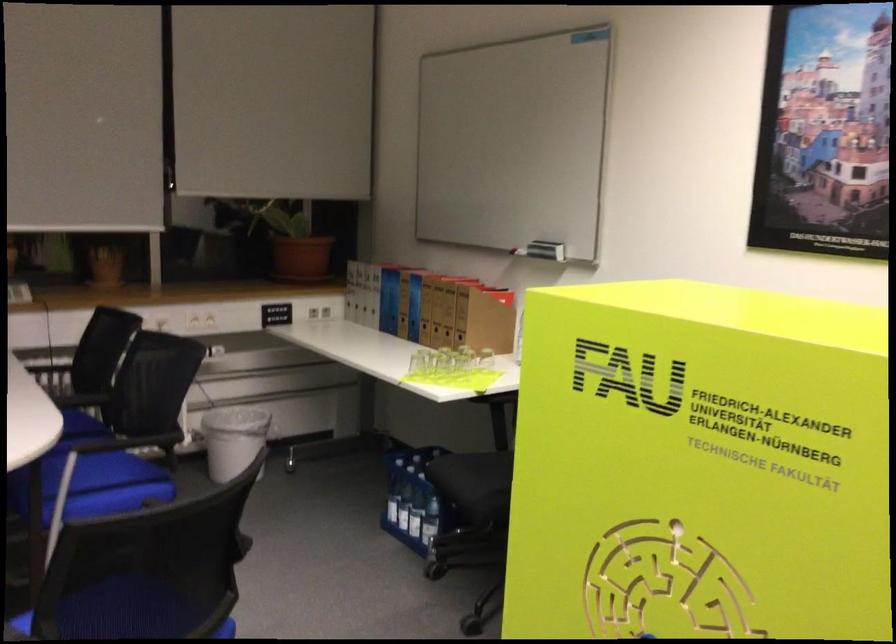
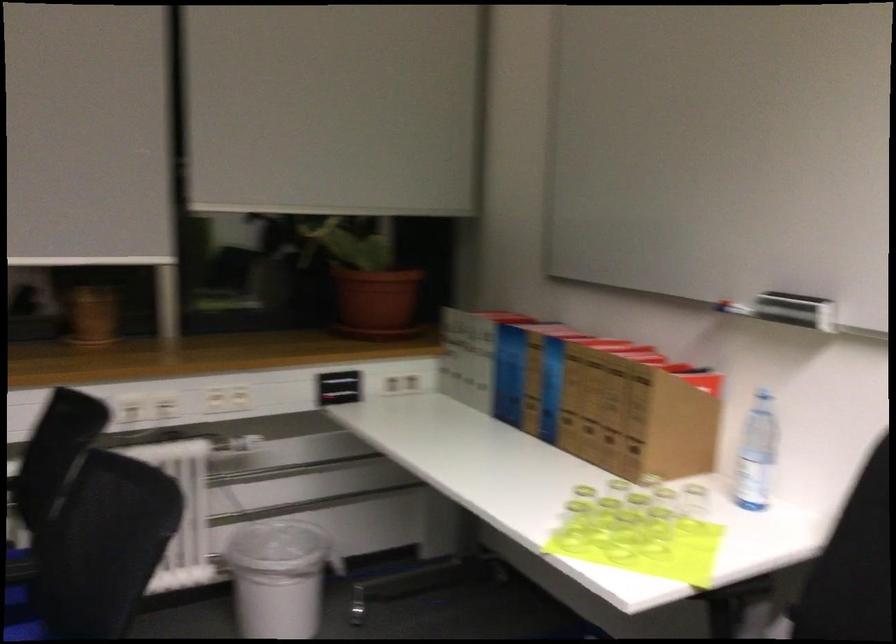
The point at [392,299] is marked in the first image. Where is the corresponding point in the second image?

(509, 374)